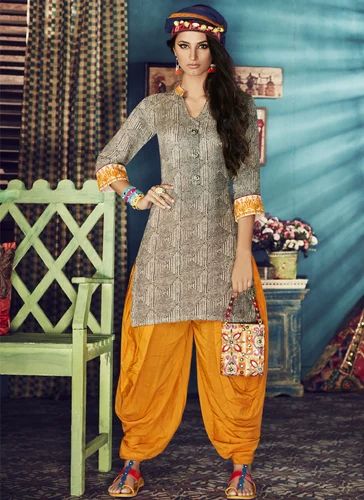
Locate an element on the screen. chair is located at coordinates (50, 339).